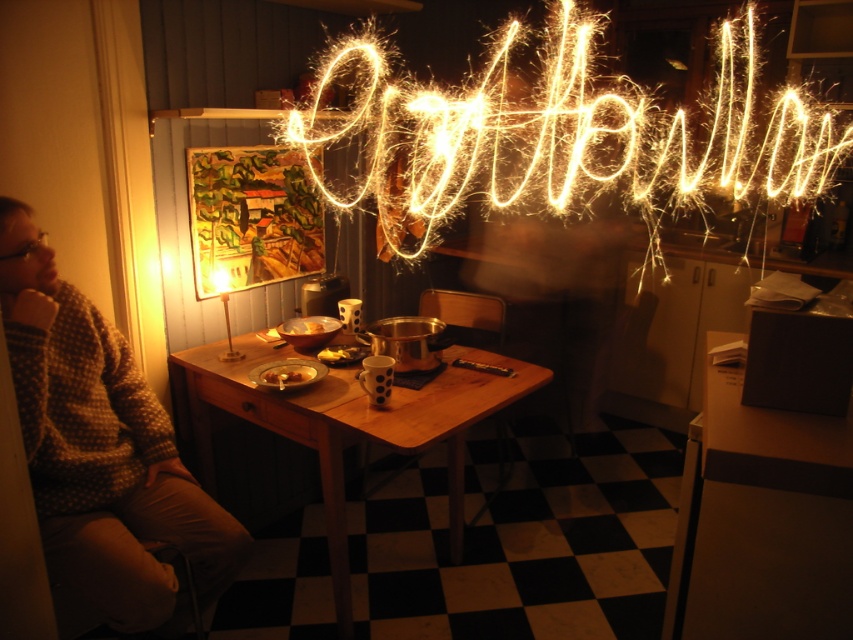
Question: Does sparkling neon sign at upper center have a smaller size compared to wooden table at center?

Choices:
 (A) yes
 (B) no

Answer: (B)

Question: Which point is closer to the camera taking this photo?

Choices:
 (A) (96, 410)
 (B) (450, 444)
 (C) (274, 378)

Answer: (A)

Question: Is sparkling neon sign at upper center to the right of smooth brown bread at table center from the viewer's perspective?

Choices:
 (A) no
 (B) yes

Answer: (B)

Question: Is sparkling neon sign at upper center below smooth brown bread at table center?

Choices:
 (A) no
 (B) yes

Answer: (A)

Question: Among these points, which one is nearest to the camera?

Choices:
 (A) (279, 381)
 (B) (526, 376)
 (C) (351, 116)
 (D) (68, 536)

Answer: (D)

Question: Which point is farther from the camera taking this photo?

Choices:
 (A) (178, 352)
 (B) (279, 372)

Answer: (A)